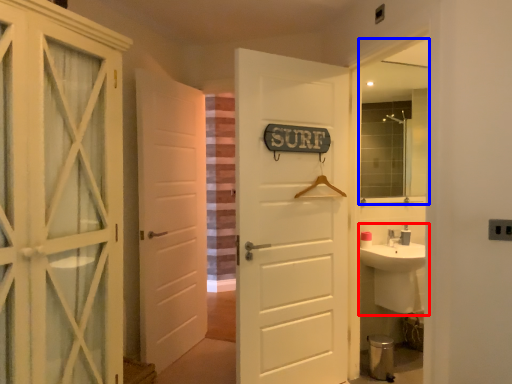
Question: Which point is closer to the camera, sink (highlighted by a red box) or mirror (highlighted by a blue box)?

Choices:
 (A) sink
 (B) mirror

Answer: (A)